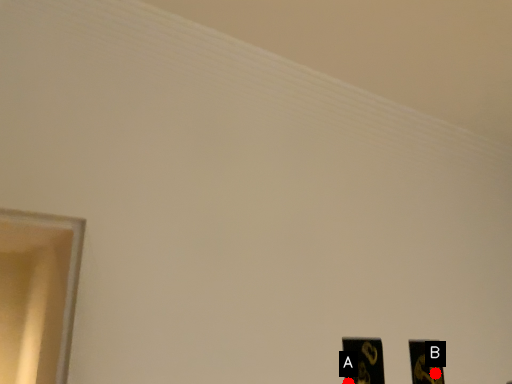
Question: Two points are circled on the image, labeled by A and B beside each circle. Which of the following is the closest to the observer?

Choices:
 (A) A is closer
 (B) B is closer

Answer: (A)